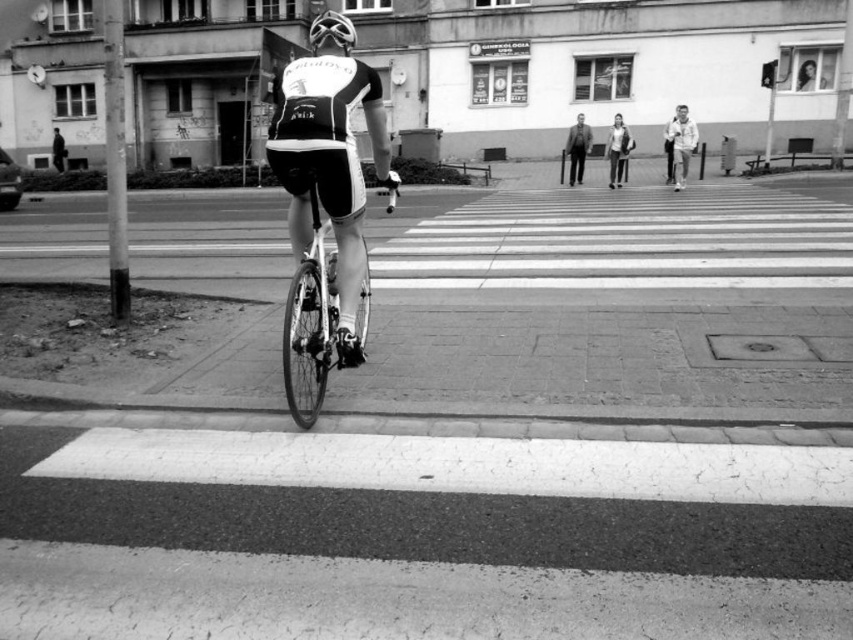
Question: Can you confirm if light brown leather jacket at center is thinner than dark gray suit at center?

Choices:
 (A) no
 (B) yes

Answer: (A)

Question: Is light brown leather jacket at center above dark gray suit at center?

Choices:
 (A) no
 (B) yes

Answer: (A)

Question: Among these points, which one is nearest to the camera?

Choices:
 (A) (612, 140)
 (B) (339, 22)

Answer: (B)

Question: Which of these objects is positioned farthest from the dark gray suit at center?

Choices:
 (A) light brown leather jacket at center
 (B) shiny black helmet at center
 (C) light gray fabric jacket at upper right

Answer: (B)

Question: Which object is closer to the camera taking this photo?

Choices:
 (A) dark gray suit at center
 (B) shiny black helmet at center
 (C) light gray fabric jacket at upper right

Answer: (B)

Question: Does light gray fabric jacket at upper right appear on the right side of dark gray suit at center?

Choices:
 (A) no
 (B) yes

Answer: (B)